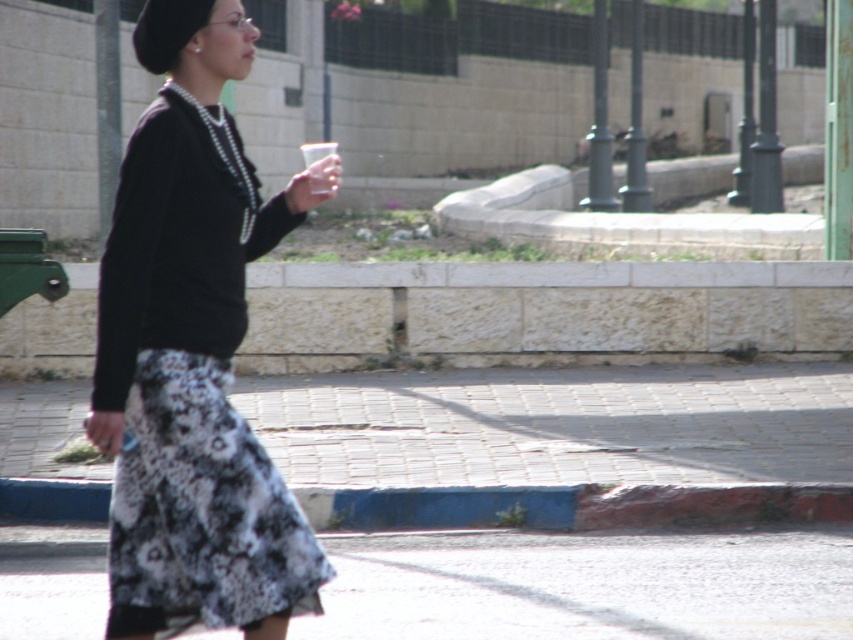
Question: Which point appears closest to the camera in this image?

Choices:
 (A) (38, 612)
 (B) (119, 230)
 (C) (199, 106)

Answer: (B)

Question: Is black matte sweater at center closer to camera compared to pearl necklace at upper center?

Choices:
 (A) yes
 (B) no

Answer: (A)

Question: Which of the following is the farthest from the observer?

Choices:
 (A) (521, 637)
 (B) (196, 342)
 (C) (236, 186)

Answer: (A)

Question: Is black matte sweater at center wider than white textured pavement at lower center?

Choices:
 (A) yes
 (B) no

Answer: (B)

Question: Which object is the farthest from the pearl necklace at upper center?

Choices:
 (A) black matte sweater at center
 (B) white textured pavement at lower center

Answer: (B)

Question: Is black matte sweater at center to the left of white textured pavement at lower center from the viewer's perspective?

Choices:
 (A) no
 (B) yes

Answer: (B)